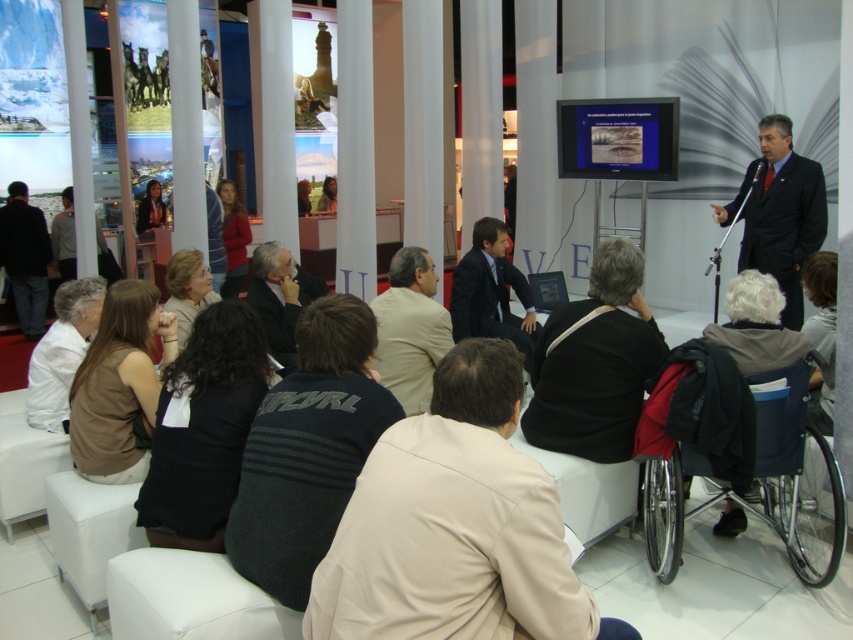
Question: In this image, where is dark gray knit sweater at center located relative to matte red sweater at center?

Choices:
 (A) below
 (B) above

Answer: (A)

Question: Is brown fabric shirt at lower left wider than dark brown hair at lower right?

Choices:
 (A) no
 (B) yes

Answer: (B)

Question: Estimate the real-world distances between objects in this image. Which object is farther from the white fabric at lower left?

Choices:
 (A) matte red sweater at center
 (B) dark gray suit at left

Answer: (B)

Question: Which of the following is the farthest from the observer?

Choices:
 (A) matte red sweater at center
 (B) dark blue suit at center
 (C) black plastic wheelchair at lower right

Answer: (A)

Question: Can you confirm if beige fabric jacket at center is positioned above dark blue suit at center?

Choices:
 (A) no
 (B) yes

Answer: (A)

Question: Estimate the real-world distances between objects in this image. Which object is closer to the dark gray knit sweater at center?

Choices:
 (A) dark gray suit at center
 (B) matte black jacket at upper left

Answer: (A)